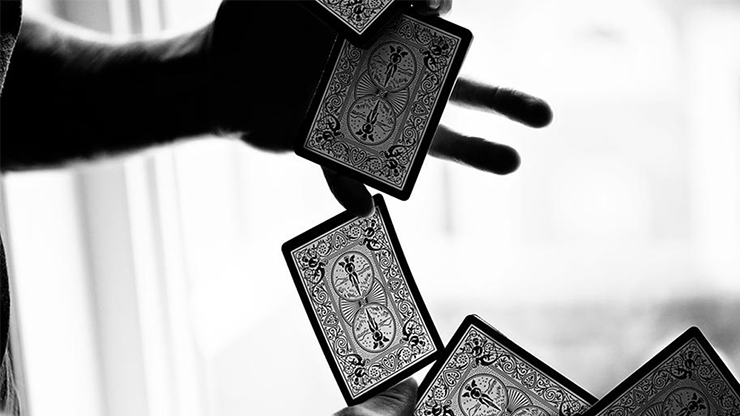
You are a GUI agent. You are given a task and a screenshot of the screen. Output one action in this format:
    pyautogui.click(x=<x>, y=<y>)
    Task: Click on the window
    The height and width of the screenshot is (416, 740).
    Given the screenshot: What is the action you would take?
    pyautogui.click(x=564, y=200)